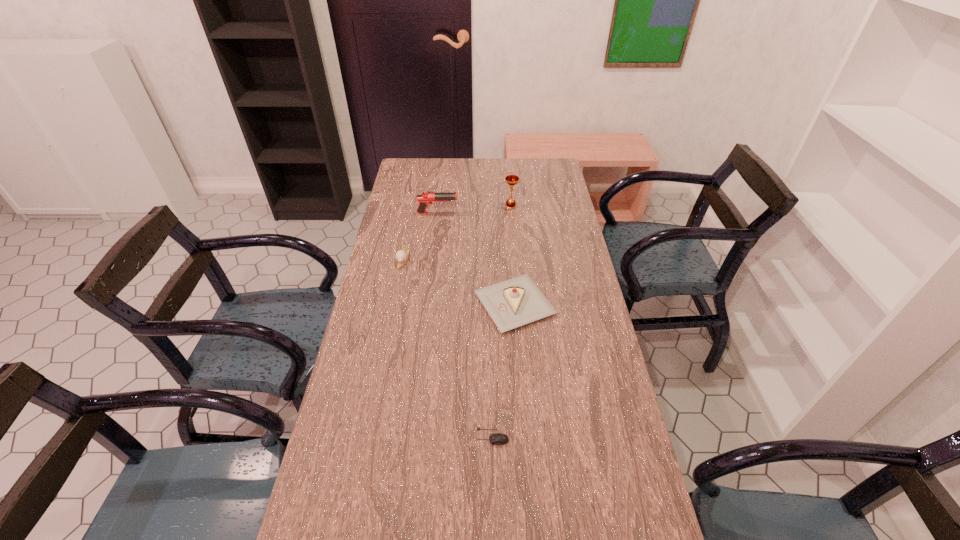
Point out which object is positioned as the second nearest to the third farthest object. Please provide its 2D coordinates. Your answer should be formatted as a tuple, i.e. [(x, y)], where the tuple contains the x and y coordinates of a point satisfying the conditions above.

[(513, 303)]

You are a GUI agent. You are given a task and a screenshot of the screen. Output one action in this format:
    pyautogui.click(x=<x>, y=<y>)
    Task: Click on the closest object to the cake
    The height and width of the screenshot is (540, 960).
    Given the screenshot: What is the action you would take?
    pyautogui.click(x=401, y=256)

At what (x,y) coordinates should I click in order to perform the action: click on vacant space that satisfies the following two spatial constraints: 1. on the shell of the nearest object; 2. on the right side of the fourth tallest object. Please return your answer as a coordinate pair (x, y). The image size is (960, 540). Looking at the image, I should click on (369, 437).

You are a GUI agent. You are given a task and a screenshot of the screen. Output one action in this format:
    pyautogui.click(x=<x>, y=<y>)
    Task: Click on the vacant position in the image that satisfies the following two spatial constraints: 1. at the aiming end of the gun; 2. on the shell of the escargot
    The width and height of the screenshot is (960, 540).
    Given the screenshot: What is the action you would take?
    pyautogui.click(x=432, y=259)

Identify the location of vacant position in the image that satisfies the following two spatial constraints: 1. at the aiming end of the third tallest object; 2. on the left side of the second farthest object. (426, 305).

Where is `vacant region that satisfies the following two spatial constraints: 1. at the aiming end of the gun; 2. on the left side of the nearest object`? vacant region that satisfies the following two spatial constraints: 1. at the aiming end of the gun; 2. on the left side of the nearest object is located at coordinates (410, 437).